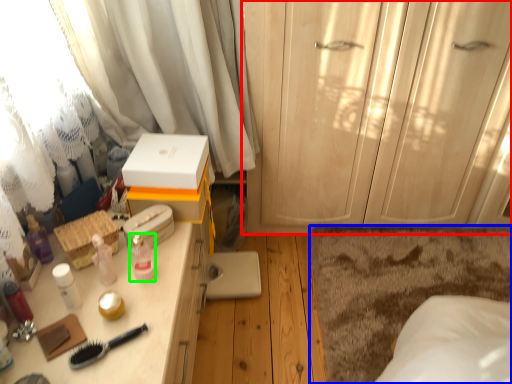
Question: Considering the real-world distances, which object is closest to cabinetry (highlighted by a red box)? plain (highlighted by a blue box) or toiletry (highlighted by a green box).

Choices:
 (A) plain
 (B) toiletry

Answer: (A)